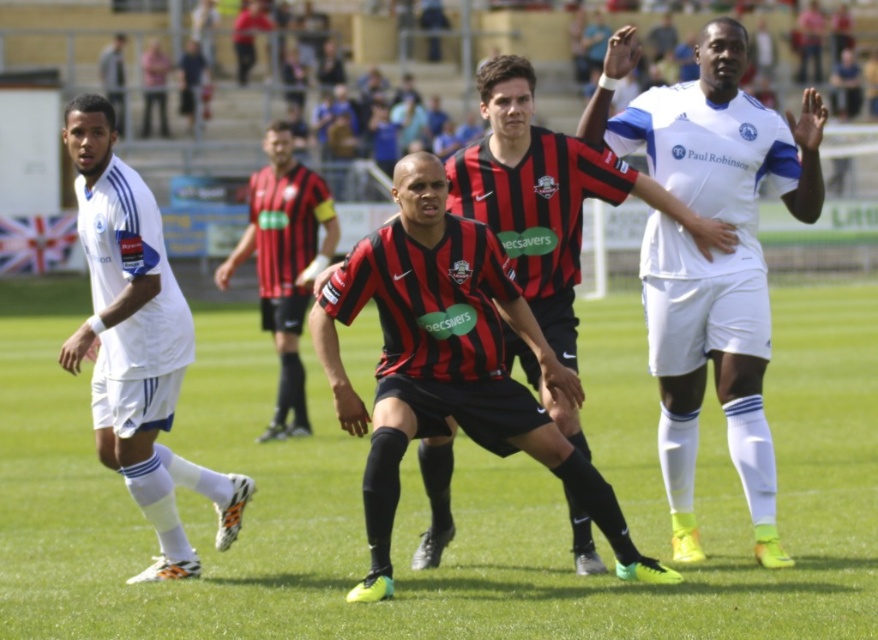
Based on the photo, is white matte jersey at center positioned before black matte jersey at center?

No, white matte jersey at center is further to the viewer.

Based on the photo, can you confirm if white matte jersey at center is positioned to the left of black matte jersey at center?

Incorrect, white matte jersey at center is not on the left side of black matte jersey at center.

Image resolution: width=878 pixels, height=640 pixels. I want to click on white matte jersey at center, so click(711, 259).

The width and height of the screenshot is (878, 640). I want to click on white matte jersey at center, so click(x=711, y=259).

Is white matte jersey at center shorter than white matte soccer uniform at left?

No, white matte jersey at center is not shorter than white matte soccer uniform at left.

Can you confirm if white matte jersey at center is positioned to the right of white matte soccer uniform at left?

Yes, white matte jersey at center is to the right of white matte soccer uniform at left.

Which is behind, point (718, 339) or point (90, 320)?

The point (718, 339) is more distant.

Locate an element on the screen. This screenshot has height=640, width=878. white matte jersey at center is located at coordinates (711, 259).

Locate an element on the screen. The height and width of the screenshot is (640, 878). black matte jersey at center is located at coordinates (545, 196).

The height and width of the screenshot is (640, 878). Describe the element at coordinates (545, 196) in the screenshot. I see `black matte jersey at center` at that location.

Find the location of `black matte jersey at center`. black matte jersey at center is located at coordinates (545, 196).